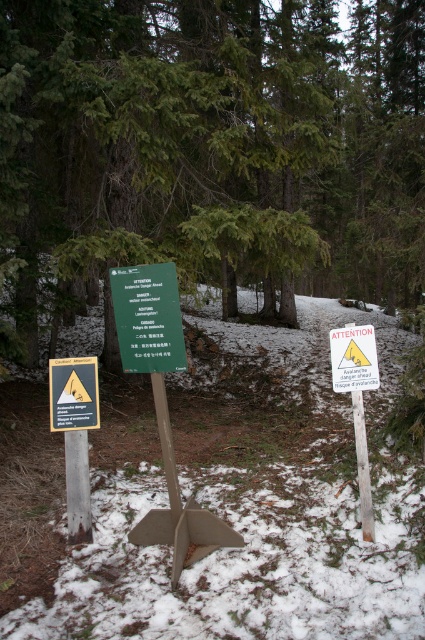
Which of these two, green matte sign at center or yellowmaterial/texturesign at left, stands shorter?

yellowmaterial/texturesign at left is shorter.

Does green matte sign at center have a smaller size compared to yellowmaterial/texturesign at left?

Incorrect, green matte sign at center is not smaller in size than yellowmaterial/texturesign at left.

The height and width of the screenshot is (640, 425). Describe the element at coordinates (207, 152) in the screenshot. I see `green matte sign at center` at that location.

Locate an element on the screen. This screenshot has height=640, width=425. green matte sign at center is located at coordinates (207, 152).

Where is `yellowmaterial/texturesign at left`? The width and height of the screenshot is (425, 640). yellowmaterial/texturesign at left is located at coordinates (73, 394).

Is point (62, 401) positioned after point (374, 349)?

Yes, point (62, 401) is farther from viewer.

What do you see at coordinates (73, 394) in the screenshot?
I see `yellowmaterial/texturesign at left` at bounding box center [73, 394].

Locate an element on the screen. This screenshot has height=640, width=425. yellowmaterial/texturesign at left is located at coordinates (73, 394).

Between green wood sign at center and white paper sign at center, which one has less height?

white paper sign at center is shorter.

Is green wood sign at center thinner than white paper sign at center?

Incorrect, green wood sign at center's width is not less than white paper sign at center's.

Does point (170, 278) come closer to viewer compared to point (351, 362)?

Yes, it is.

What are the coordinates of `green wood sign at center` in the screenshot? It's located at (147, 317).